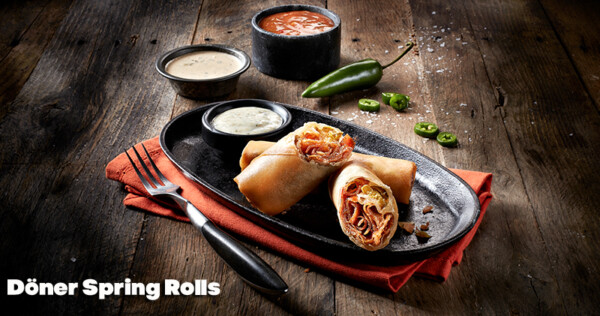
Image resolution: width=600 pixels, height=316 pixels. In order to click on handle in this screenshot , I will do `click(232, 252)`.